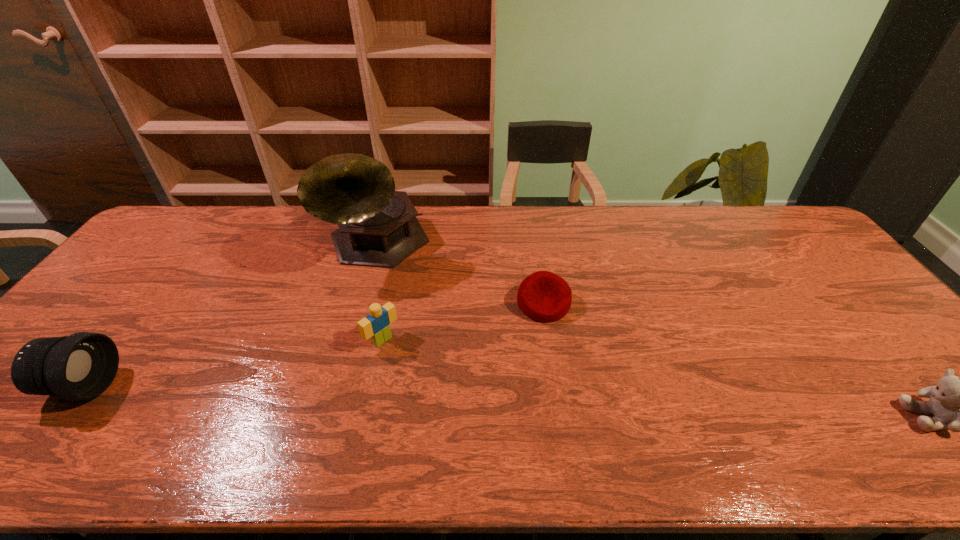
At what (x,y) coordinates should I click in order to perform the action: click on free spot located 0.090m on the face of the Lego. Please return your answer as a coordinate pair (x, y). Looking at the image, I should click on (415, 369).

I want to click on free spot located on the face of the Lego, so click(415, 369).

Identify the location of free point located on the face of the Lego. (446, 395).

I want to click on vacant space located 0.190m on the horn direction of the tallest object, so click(409, 327).

The image size is (960, 540). I want to click on free space located 0.120m on the horn direction of the tallest object, so click(401, 310).

I want to click on vacant space located on the horn direction of the tallest object, so click(x=432, y=382).

You are a GUI agent. You are given a task and a screenshot of the screen. Output one action in this format:
    pyautogui.click(x=<x>, y=<y>)
    Task: Click on the object positioned at the far edge
    This screenshot has height=540, width=960.
    Given the screenshot: What is the action you would take?
    pyautogui.click(x=378, y=227)

At what (x,y) coordinates should I click in order to perform the action: click on object situated at the near edge. Please return your answer as a coordinate pair (x, y). The width and height of the screenshot is (960, 540). Looking at the image, I should click on (81, 366).

Find the location of a particular element. object present at the left edge is located at coordinates (81, 366).

Locate an element on the screen. The height and width of the screenshot is (540, 960). object located in the near left corner section of the desktop is located at coordinates (81, 366).